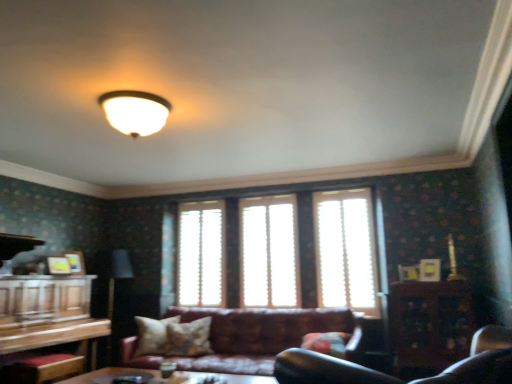
From the picture: What is the approximate width of patterned fabric pillow at lower left, the 1th pillow from the left?

patterned fabric pillow at lower left, the 1th pillow from the left, is 30.87 centimeters wide.

Locate an element on the screen. patterned fabric pillow at lower left, the 3th pillow positioned from the right is located at coordinates (153, 335).

What do you see at coordinates (345, 250) in the screenshot? The width and height of the screenshot is (512, 384). I see `white wood blinds at center, which ranks as the 1th window in right-to-left order` at bounding box center [345, 250].

What do you see at coordinates (269, 252) in the screenshot? I see `translucent wood blinds at center, the 2th window in the left-to-right sequence` at bounding box center [269, 252].

The height and width of the screenshot is (384, 512). What do you see at coordinates (135, 111) in the screenshot? I see `matte white ceiling light at upper center` at bounding box center [135, 111].

Locate an element on the screen. This screenshot has height=384, width=512. patterned fabric pillow at lower left, the 3th pillow positioned from the right is located at coordinates pyautogui.click(x=153, y=335).

Considering the relative sizes of fluffy fabric pillow at lower center, which ranks as the 1th pillow in right-to-left order, and white wood blinds at center, which ranks as the 1th window in right-to-left order, in the image provided, is fluffy fabric pillow at lower center, which ranks as the 1th pillow in right-to-left order, taller than white wood blinds at center, which ranks as the 1th window in right-to-left order,?

No.

Considering the relative positions of fluffy fabric pillow at lower center, which ranks as the 1th pillow in right-to-left order, and white wood blinds at center, which ranks as the 1th window in right-to-left order, in the image provided, is fluffy fabric pillow at lower center, which ranks as the 1th pillow in right-to-left order, to the right of white wood blinds at center, which ranks as the 1th window in right-to-left order, from the viewer's perspective?

No.

Is fluffy fabric pillow at lower center, which ranks as the 1th pillow in right-to-left order, spatially inside white wood blinds at center, which ranks as the 1th window in right-to-left order, or outside of it?

fluffy fabric pillow at lower center, which ranks as the 1th pillow in right-to-left order, is located beyond the bounds of white wood blinds at center, which ranks as the 1th window in right-to-left order.

Between fluffy fabric pillow at lower center, which ranks as the 1th pillow in right-to-left order, and white wood blinds at center, which ranks as the 1th window in right-to-left order, which one has larger size?

white wood blinds at center, which ranks as the 1th window in right-to-left order.

What's the angular difference between leather couch at center and translucent wood blinds at center, the 2th window in the left-to-right sequence,'s facing directions?

1.15 degrees.

Would you say leather couch at center is a long distance from translucent wood blinds at center, placed as the second window when sorted from right to left?

Actually, leather couch at center and translucent wood blinds at center, placed as the second window when sorted from right to left, are a little close together.

In terms of width, does leather couch at center look wider or thinner when compared to translucent wood blinds at center, placed as the second window when sorted from right to left?

leather couch at center is wider than translucent wood blinds at center, placed as the second window when sorted from right to left.

Does leather couch at center turn towards translucent wood blinds at center, the 2th window in the left-to-right sequence?

No, leather couch at center is not turned towards translucent wood blinds at center, the 2th window in the left-to-right sequence.

How different are the orientations of fluffy fabric pillow at lower center, which ranks as the 1th pillow in right-to-left order, and matte white ceiling light at upper center in degrees?

The facing directions of fluffy fabric pillow at lower center, which ranks as the 1th pillow in right-to-left order, and matte white ceiling light at upper center are 0.685 degrees apart.

Considering the sizes of fluffy fabric pillow at lower center, the 3th pillow viewed from the left, and matte white ceiling light at upper center in the image, is fluffy fabric pillow at lower center, the 3th pillow viewed from the left, wider or thinner than matte white ceiling light at upper center?

fluffy fabric pillow at lower center, the 3th pillow viewed from the left, is wider than matte white ceiling light at upper center.

Is matte white ceiling light at upper center surrounded by fluffy fabric pillow at lower center, which ranks as the 1th pillow in right-to-left order?

No, matte white ceiling light at upper center is not surrounded by fluffy fabric pillow at lower center, which ranks as the 1th pillow in right-to-left order.

Is fluffy fabric pillow at lower center, which ranks as the 1th pillow in right-to-left order, oriented away from matte white ceiling light at upper center?

No, fluffy fabric pillow at lower center, which ranks as the 1th pillow in right-to-left order, is not facing the opposite direction of matte white ceiling light at upper center.

Would you say matte white ceiling light at upper center is outside white wood blinds at center, which ranks as the first window in left-to-right order?

That's correct, matte white ceiling light at upper center is outside of white wood blinds at center, which ranks as the first window in left-to-right order.

Is point (146, 128) positioned behind point (217, 279)?

No, (146, 128) is in front of (217, 279).

Which object is more forward, matte white ceiling light at upper center or white wood blinds at center, which ranks as the first window in left-to-right order?

matte white ceiling light at upper center.

Does matte white ceiling light at upper center have a lesser width compared to white wood blinds at center, which ranks as the first window in left-to-right order?

No.

You are a GUI agent. You are given a task and a screenshot of the screen. Output one action in this format:
    pyautogui.click(x=<x>, y=<y>)
    Task: Click on the 3rd window to the right of the wooden entertainment center at left, counting from the anchor's position
    This screenshot has height=384, width=512.
    Given the screenshot: What is the action you would take?
    pyautogui.click(x=345, y=250)

Could you measure the distance between wooden entertainment center at left and white wood blinds at center, the 3th window positioned from the left?

wooden entertainment center at left is 8.70 feet from white wood blinds at center, the 3th window positioned from the left.

Is wooden entertainment center at left positioned with its back to white wood blinds at center, the 3th window positioned from the left?

No, wooden entertainment center at left's orientation is not away from white wood blinds at center, the 3th window positioned from the left.

Which of these two, wooden entertainment center at left or white wood blinds at center, which ranks as the 1th window in right-to-left order, is smaller?

white wood blinds at center, which ranks as the 1th window in right-to-left order.

In terms of height, does white wood blinds at center, which is the third window in right-to-left order, look taller or shorter compared to wooden cabinet at right?

Clearly, white wood blinds at center, which is the third window in right-to-left order, is taller compared to wooden cabinet at right.

Considering the relative sizes of white wood blinds at center, which ranks as the first window in left-to-right order, and wooden cabinet at right in the image provided, is white wood blinds at center, which ranks as the first window in left-to-right order, wider than wooden cabinet at right?

No, white wood blinds at center, which ranks as the first window in left-to-right order, is not wider than wooden cabinet at right.

In the scene shown: Is white wood blinds at center, which is the third window in right-to-left order, looking in the opposite direction of wooden cabinet at right?

No, white wood blinds at center, which is the third window in right-to-left order,'s orientation is not away from wooden cabinet at right.

Is white wood blinds at center, which ranks as the first window in left-to-right order, not close to wooden cabinet at right?

white wood blinds at center, which ranks as the first window in left-to-right order, is far away from wooden cabinet at right.

This screenshot has width=512, height=384. I want to click on the 1st window behind the wooden cabinet at right, starting your count from the anchor, so click(x=345, y=250).

From a real-world perspective, is wooden cabinet at right on top of white wood blinds at center, the 3th window positioned from the left?

No, from a real-world perspective, wooden cabinet at right is not above white wood blinds at center, the 3th window positioned from the left.

Does wooden cabinet at right turn towards white wood blinds at center, which ranks as the 1th window in right-to-left order?

No, wooden cabinet at right is not oriented towards white wood blinds at center, which ranks as the 1th window in right-to-left order.

Can we say wooden cabinet at right lies outside white wood blinds at center, the 3th window positioned from the left?

Yes.

The width and height of the screenshot is (512, 384). Identify the location of the 1st window above the fluffy fabric pillow at lower center, which ranks as the 1th pillow in right-to-left order (from a real-world perspective). (345, 250).

Locate an element on the screen. This screenshot has height=384, width=512. the 2nd window above when counting from the leather couch at center (from the image's perspective) is located at coordinates (269, 252).

Which object lies further to the anchor point wooden cabinet at right, wooden entertainment center at left or translucent wood blinds at center, placed as the second window when sorted from right to left?

Based on the image, wooden entertainment center at left appears to be further to wooden cabinet at right.

Considering their positions, is patterned fabric pillow at lower left, the 3th pillow positioned from the right, positioned further to leather couch at center than fluffy fabric pillow at lower center, which ranks as the 1th pillow in right-to-left order?

patterned fabric pillow at lower left, the 3th pillow positioned from the right, is further to leather couch at center.

Based on their spatial positions, is translucent wood blinds at center, placed as the second window when sorted from right to left, or matte white ceiling light at upper center closer to white wood blinds at center, which ranks as the 1th window in right-to-left order?

translucent wood blinds at center, placed as the second window when sorted from right to left, lies closer to white wood blinds at center, which ranks as the 1th window in right-to-left order, than the other object.

Looking at the image, which one is located closer to wooden cabinet at right, translucent wood blinds at center, placed as the second window when sorted from right to left, or matte white ceiling light at upper center?

Among the two, translucent wood blinds at center, placed as the second window when sorted from right to left, is located nearer to wooden cabinet at right.

Which object lies further to the anchor point white wood blinds at center, which is the third window in right-to-left order, fluffy fabric pillow at lower center, the 3th pillow viewed from the left, or patterned fabric pillow at center, marked as the 2th pillow in a right-to-left arrangement?

fluffy fabric pillow at lower center, the 3th pillow viewed from the left, lies further to white wood blinds at center, which is the third window in right-to-left order, than the other object.

Based on their spatial positions, is fluffy fabric pillow at lower center, the 3th pillow viewed from the left, or wooden entertainment center at left further from leather couch at center?

Based on the image, wooden entertainment center at left appears to be further to leather couch at center.

When comparing their distances from wooden cabinet at right, does fluffy fabric pillow at lower center, which ranks as the 1th pillow in right-to-left order, or wooden entertainment center at left seem closer?

fluffy fabric pillow at lower center, which ranks as the 1th pillow in right-to-left order.

Looking at the image, which one is located further to patterned fabric pillow at center, positioned as the second pillow in left-to-right order, leather couch at center or fluffy fabric pillow at lower center, which ranks as the 1th pillow in right-to-left order?

Based on the image, fluffy fabric pillow at lower center, which ranks as the 1th pillow in right-to-left order, appears to be further to patterned fabric pillow at center, positioned as the second pillow in left-to-right order.

The width and height of the screenshot is (512, 384). In order to click on studio couch between patterned fabric pillow at center, positioned as the second pillow in left-to-right order, and fluffy fabric pillow at lower center, which ranks as the 1th pillow in right-to-left order, in the horizontal direction in this screenshot , I will do `click(251, 338)`.

Locate an element on the screen. This screenshot has height=384, width=512. pillow located between white wood blinds at center, which ranks as the first window in left-to-right order, and wooden cabinet at right in the left-right direction is located at coordinates (326, 343).

Where is `pillow between translucent wood blinds at center, the 2th window in the left-to-right sequence, and wooden cabinet at right`? pillow between translucent wood blinds at center, the 2th window in the left-to-right sequence, and wooden cabinet at right is located at coordinates (326, 343).

Image resolution: width=512 pixels, height=384 pixels. I want to click on pillow between leather couch at center and wooden cabinet at right, so click(326, 343).